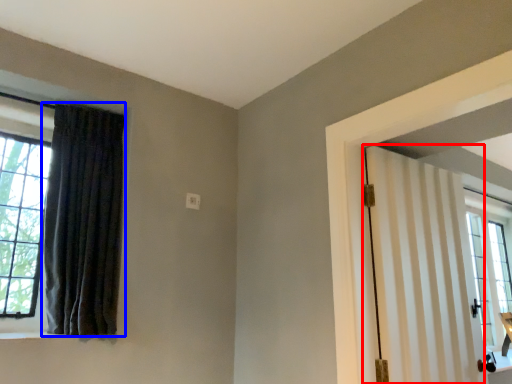
Question: Among these objects, which one is farthest to the camera, door (highlighted by a red box) or curtain (highlighted by a blue box)?

Choices:
 (A) door
 (B) curtain

Answer: (B)